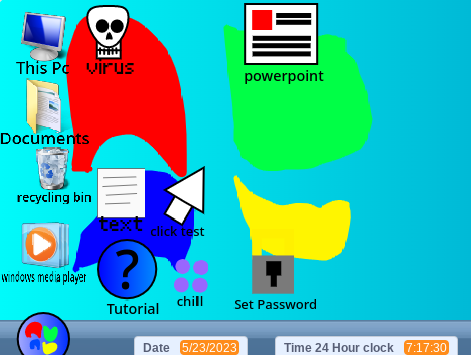
Identify the location of clear trash can. This screenshot has height=355, width=471. (55, 168), (52, 178), (52, 163), (42, 158), (46, 182), (60, 159).